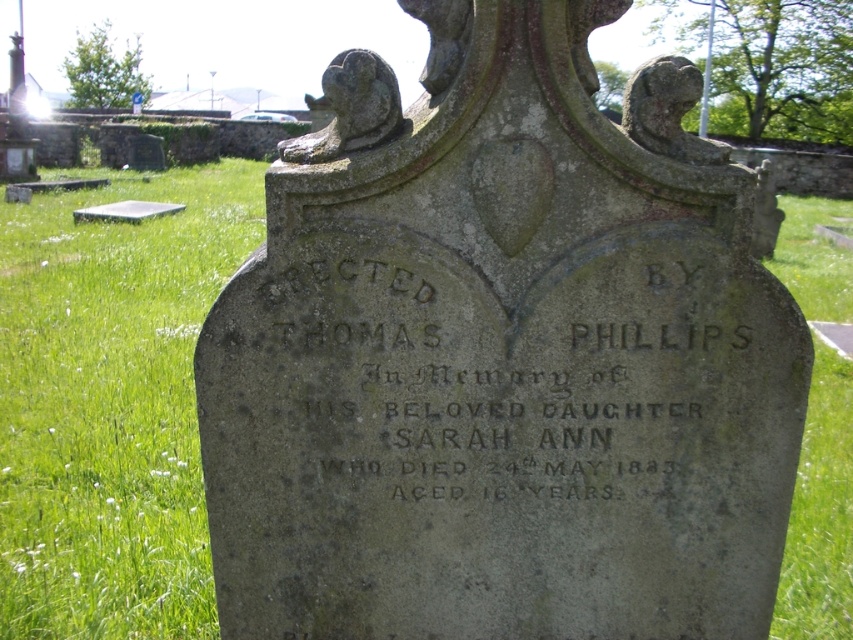
Question: In this image, where is gray stone monument at center located relative to black stone inscription at center?

Choices:
 (A) left
 (B) right

Answer: (B)

Question: Among these points, which one is farthest from the camera?

Choices:
 (A) (302, 244)
 (B) (491, 148)

Answer: (A)

Question: Which point appears farthest from the camera in this image?

Choices:
 (A) (421, 390)
 (B) (277, 540)

Answer: (B)

Question: Among these objects, which one is nearest to the camera?

Choices:
 (A) gray stone monument at center
 (B) black stone inscription at center

Answer: (A)

Question: Does gray stone monument at center have a smaller size compared to black stone inscription at center?

Choices:
 (A) no
 (B) yes

Answer: (A)

Question: Can you confirm if gray stone monument at center is wider than black stone inscription at center?

Choices:
 (A) yes
 (B) no

Answer: (A)